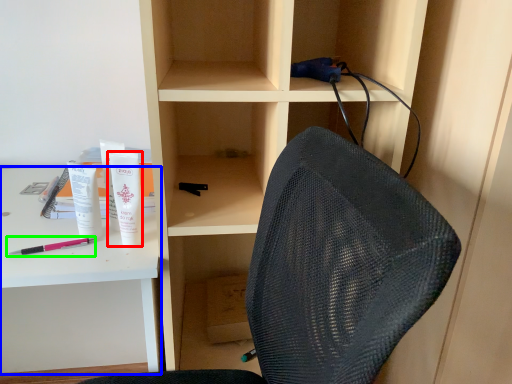
Question: Considering the real-world distances, which object is farthest from toiletry (highlighted by a red box)? desk (highlighted by a blue box) or pencil (highlighted by a green box)?

Choices:
 (A) desk
 (B) pencil

Answer: (A)